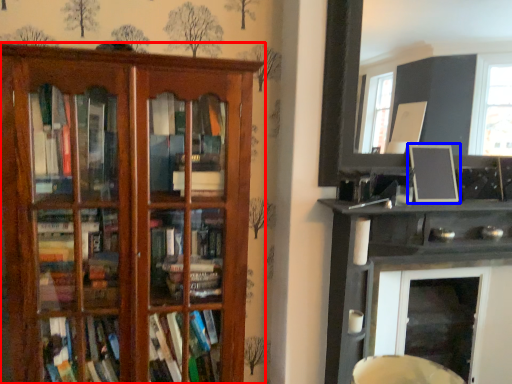
Question: Among these objects, which one is farthest to the camera, shelf (highlighted by a red box) or picture frame (highlighted by a blue box)?

Choices:
 (A) shelf
 (B) picture frame

Answer: (B)